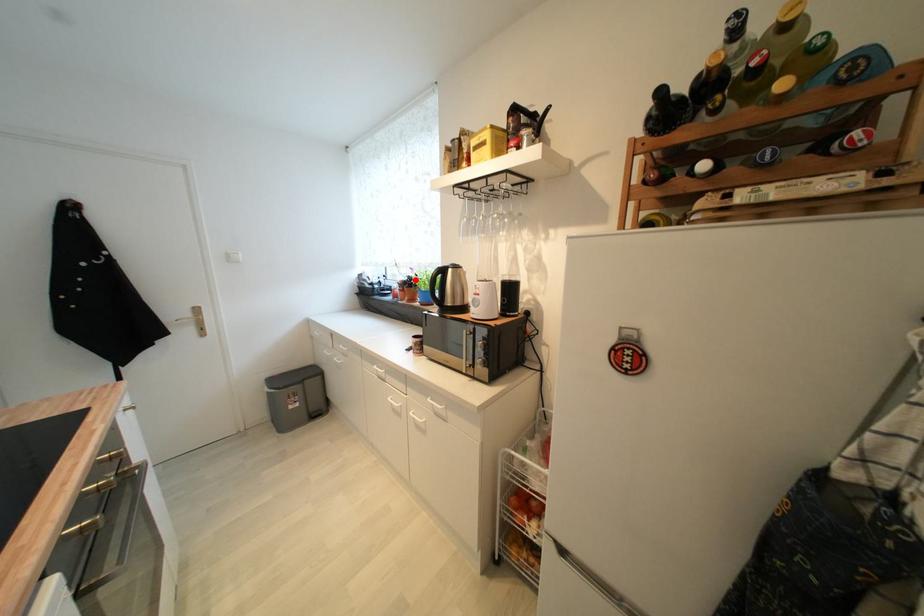
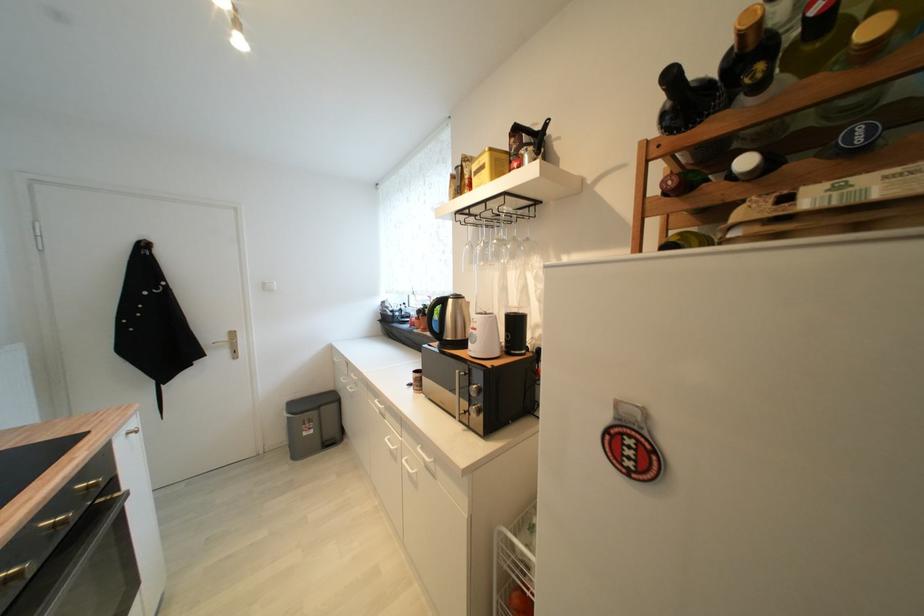
Question: I am providing you with two images of the same scene from different viewpoints. A red point is shown in image1. For the corresponding object point in image2, is it positioned nearer or farther from the camera?

Choices:
 (A) Nearer
 (B) Farther

Answer: (B)